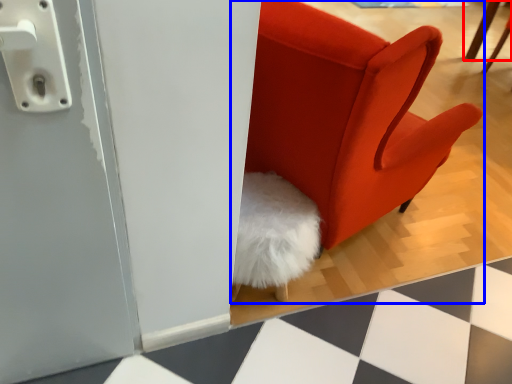
Question: Which object appears farthest to the camera in this image, furniture (highlighted by a red box) or chair (highlighted by a blue box)?

Choices:
 (A) furniture
 (B) chair

Answer: (A)